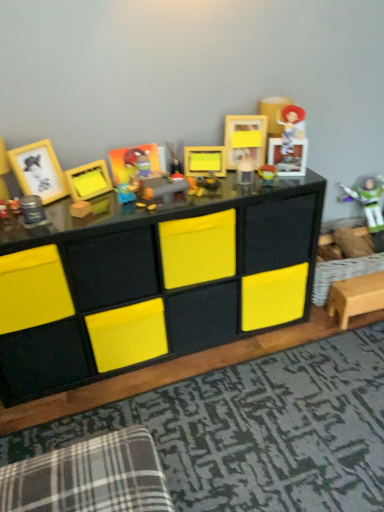
This screenshot has width=384, height=512. Find the location of `vacant space in front of metallic silver canister at left, which is the 5th toy in back-to-front order`. vacant space in front of metallic silver canister at left, which is the 5th toy in back-to-front order is located at coordinates (28, 230).